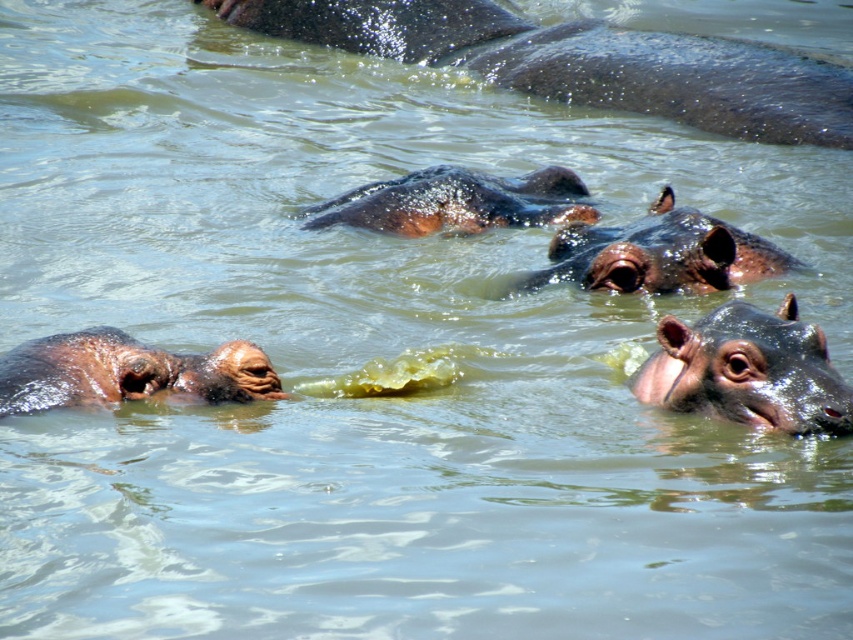
Question: Can you confirm if shiny brown hippo at right is positioned to the left of shiny brown hippo at center?

Choices:
 (A) yes
 (B) no

Answer: (A)

Question: Which of the following is the closest to the observer?

Choices:
 (A) dark brown textured hippo at upper center
 (B) brown matte hippo at center
 (C) shiny brown hippo at right

Answer: (C)

Question: Among these objects, which one is nearest to the camera?

Choices:
 (A) shiny brown hippo at center
 (B) shiny brown hippo at right
 (C) brown matte hippo at left

Answer: (C)

Question: Can you confirm if shiny brown hippo at right is smaller than shiny brown hippo at center?

Choices:
 (A) no
 (B) yes

Answer: (B)

Question: Which object is the closest to the shiny brown hippo at center?

Choices:
 (A) dark brown textured hippo at upper center
 (B) shiny brown hippo at right
 (C) brown matte hippo at left

Answer: (B)

Question: Does shiny brown hippo at right appear over brown matte hippo at center?

Choices:
 (A) no
 (B) yes

Answer: (A)